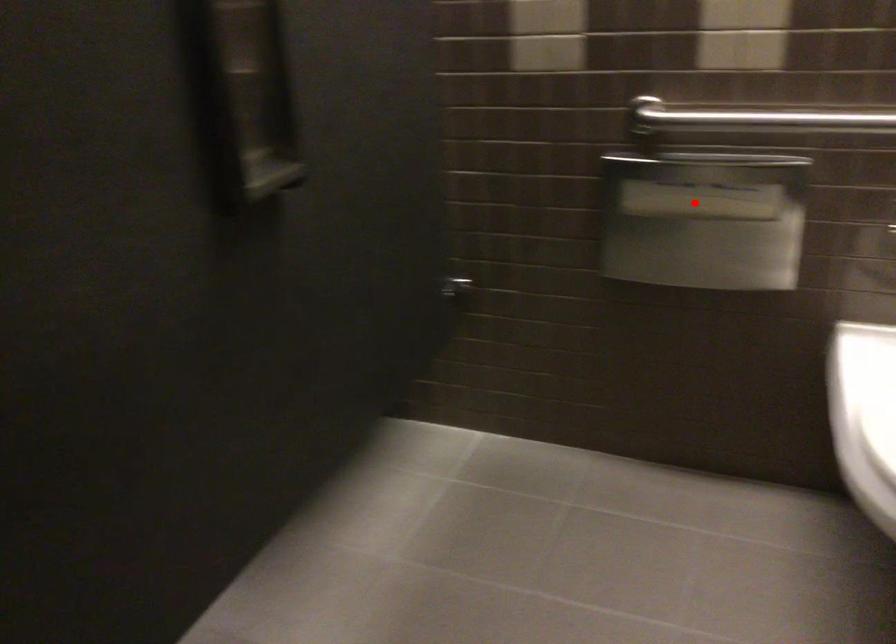
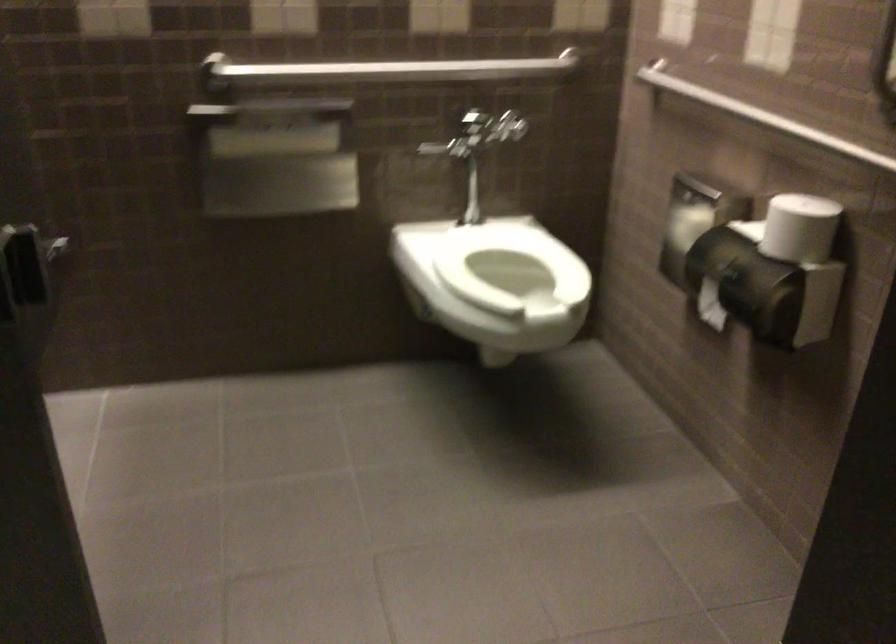
Question: I am providing you with two images of the same scene from different viewpoints. Image1 has a red point marked. In image2, the corresponding 3D location appears at what relative position? Reply with the corresponding letter.

Choices:
 (A) Closer
 (B) Farther

Answer: (B)